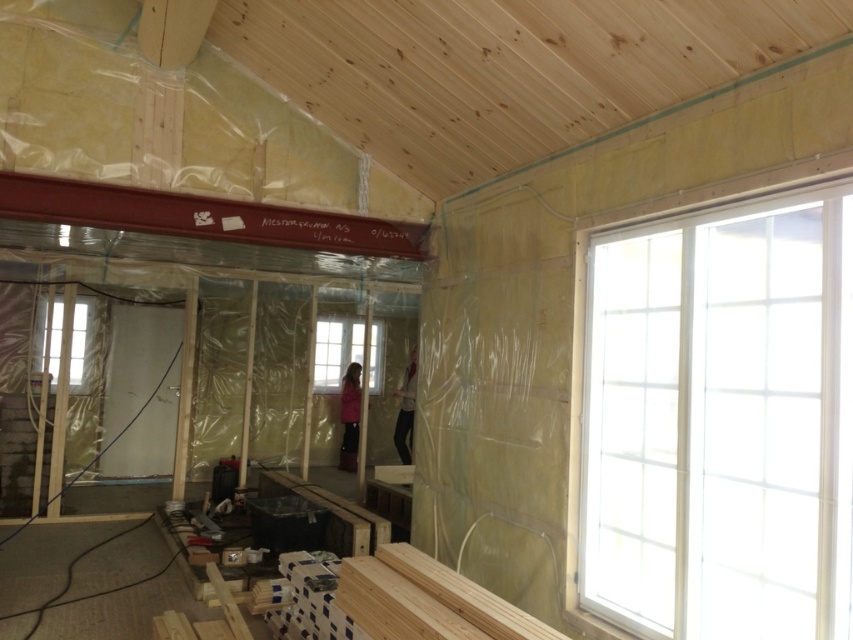
Does light brown wood plank at lower right have a greater width compared to clear glass window at left?

Correct, the width of light brown wood plank at lower right exceeds that of clear glass window at left.

Can you confirm if light brown wood plank at lower right is taller than clear glass window at left?

No, light brown wood plank at lower right is not taller than clear glass window at left.

Where is `light brown wood plank at lower right`? The height and width of the screenshot is (640, 853). light brown wood plank at lower right is located at coordinates pyautogui.click(x=463, y=595).

Which is more to the right, clear glass window at upper right or clear glass window at center?

clear glass window at upper right is more to the right.

What do you see at coordinates (721, 420) in the screenshot? I see `clear glass window at upper right` at bounding box center [721, 420].

Who is more forward, (x=840, y=410) or (x=352, y=323)?

Point (x=840, y=410) is more forward.

At what (x,y) coordinates should I click in order to perform the action: click on clear glass window at upper right. Please return your answer as a coordinate pair (x, y). This screenshot has width=853, height=640. Looking at the image, I should click on (721, 420).

In the scene shown: Who is lower down, clear glass window at center or clear glass window at left?

clear glass window at center is lower down.

Is clear glass window at center closer to the viewer compared to clear glass window at left?

No, clear glass window at center is behind clear glass window at left.

Where is `clear glass window at center`? Image resolution: width=853 pixels, height=640 pixels. clear glass window at center is located at coordinates (335, 349).